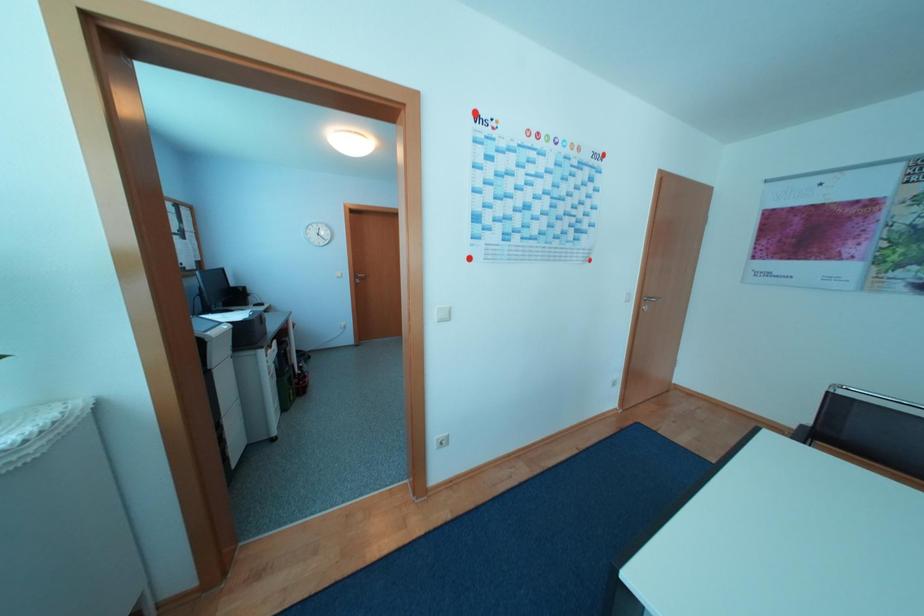
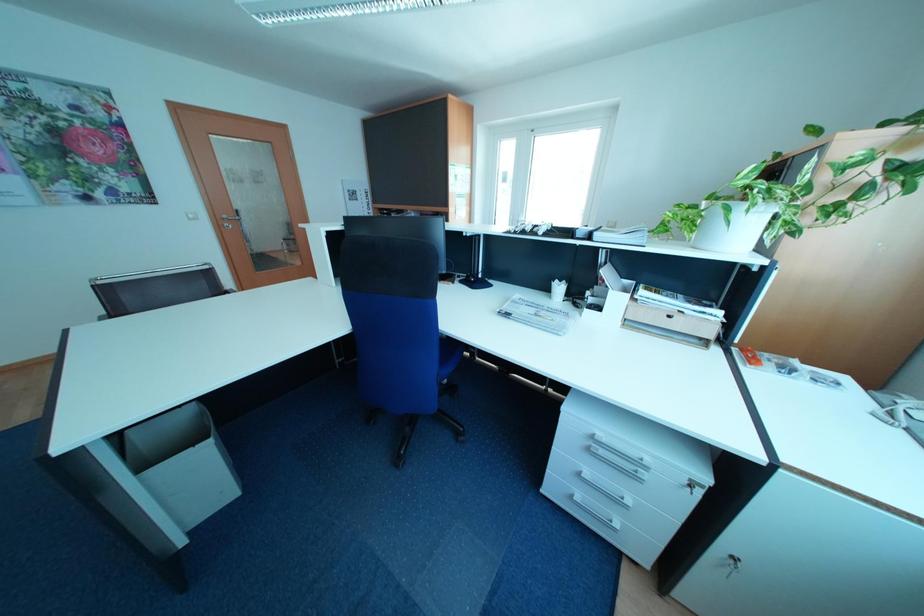
The images are taken continuously from a first-person perspective. In which direction is your viewpoint rotating?

The camera's rotation is toward right-down.